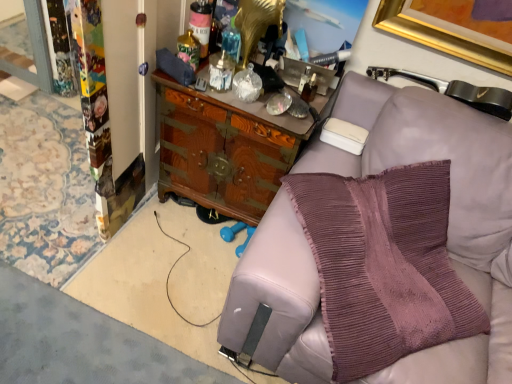
Question: Does wooden cabinet at center have a larger size compared to purple knitted pillow at right?

Choices:
 (A) yes
 (B) no

Answer: (B)

Question: Is wooden cabinet at center located outside purple knitted pillow at right?

Choices:
 (A) no
 (B) yes

Answer: (B)

Question: Considering the relative sizes of wooden cabinet at center and purple knitted pillow at right in the image provided, is wooden cabinet at center shorter than purple knitted pillow at right?

Choices:
 (A) no
 (B) yes

Answer: (B)

Question: Is wooden cabinet at center far away from purple knitted pillow at right?

Choices:
 (A) yes
 (B) no

Answer: (B)

Question: From the image's perspective, is wooden cabinet at center beneath purple knitted pillow at right?

Choices:
 (A) yes
 (B) no

Answer: (B)

Question: Is purple knitted pillow at right at the back of wooden cabinet at center?

Choices:
 (A) no
 (B) yes

Answer: (A)

Question: Can you confirm if purple knitted pillow at right is taller than wooden cabinet at center?

Choices:
 (A) yes
 (B) no

Answer: (A)

Question: From the image's perspective, is purple knitted pillow at right located beneath wooden cabinet at center?

Choices:
 (A) yes
 (B) no

Answer: (A)

Question: Are purple knitted pillow at right and wooden cabinet at center beside each other?

Choices:
 (A) no
 (B) yes

Answer: (A)

Question: Is the position of purple knitted pillow at right less distant than that of wooden cabinet at center?

Choices:
 (A) yes
 (B) no

Answer: (A)

Question: Does purple knitted pillow at right have a lesser width compared to wooden cabinet at center?

Choices:
 (A) no
 (B) yes

Answer: (B)

Question: Considering the relative sizes of purple knitted pillow at right and wooden cabinet at center in the image provided, is purple knitted pillow at right smaller than wooden cabinet at center?

Choices:
 (A) yes
 (B) no

Answer: (B)

Question: From their relative heights in the image, would you say purple knitted pillow at right is taller or shorter than wooden cabinet at center?

Choices:
 (A) tall
 (B) short

Answer: (A)